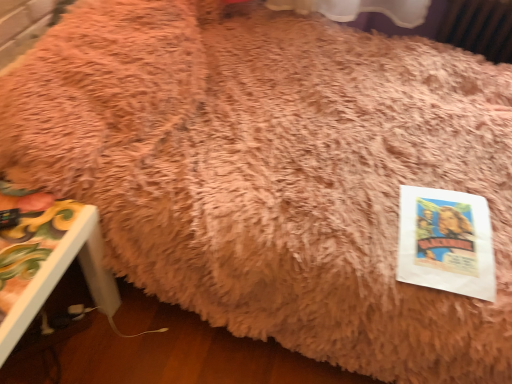
Question: Would you consider painted wood side table at lower left to be distant from white paper at lower right?

Choices:
 (A) yes
 (B) no

Answer: (B)

Question: Considering the relative sizes of painted wood side table at lower left and white paper at lower right in the image provided, is painted wood side table at lower left thinner than white paper at lower right?

Choices:
 (A) yes
 (B) no

Answer: (B)

Question: Is painted wood side table at lower left to the left of white paper at lower right from the viewer's perspective?

Choices:
 (A) no
 (B) yes

Answer: (B)

Question: Is painted wood side table at lower left facing towards white paper at lower right?

Choices:
 (A) yes
 (B) no

Answer: (A)

Question: From the image's perspective, would you say painted wood side table at lower left is shown under white paper at lower right?

Choices:
 (A) yes
 (B) no

Answer: (A)

Question: Is white paper at lower right a part of painted wood side table at lower left?

Choices:
 (A) yes
 (B) no

Answer: (B)

Question: Considering the relative sizes of white paper at lower right and painted wood side table at lower left in the image provided, is white paper at lower right bigger than painted wood side table at lower left?

Choices:
 (A) yes
 (B) no

Answer: (B)

Question: Is painted wood side table at lower left a part of white paper at lower right?

Choices:
 (A) yes
 (B) no

Answer: (B)

Question: Is white paper at lower right turned away from painted wood side table at lower left?

Choices:
 (A) no
 (B) yes

Answer: (A)

Question: Considering the relative sizes of white paper at lower right and painted wood side table at lower left in the image provided, is white paper at lower right shorter than painted wood side table at lower left?

Choices:
 (A) yes
 (B) no

Answer: (A)

Question: From the image's perspective, is white paper at lower right under painted wood side table at lower left?

Choices:
 (A) no
 (B) yes

Answer: (A)

Question: Is white paper at lower right to the right of painted wood side table at lower left from the viewer's perspective?

Choices:
 (A) no
 (B) yes

Answer: (B)

Question: From the image's perspective, is white paper at lower right positioned above or below painted wood side table at lower left?

Choices:
 (A) above
 (B) below

Answer: (A)